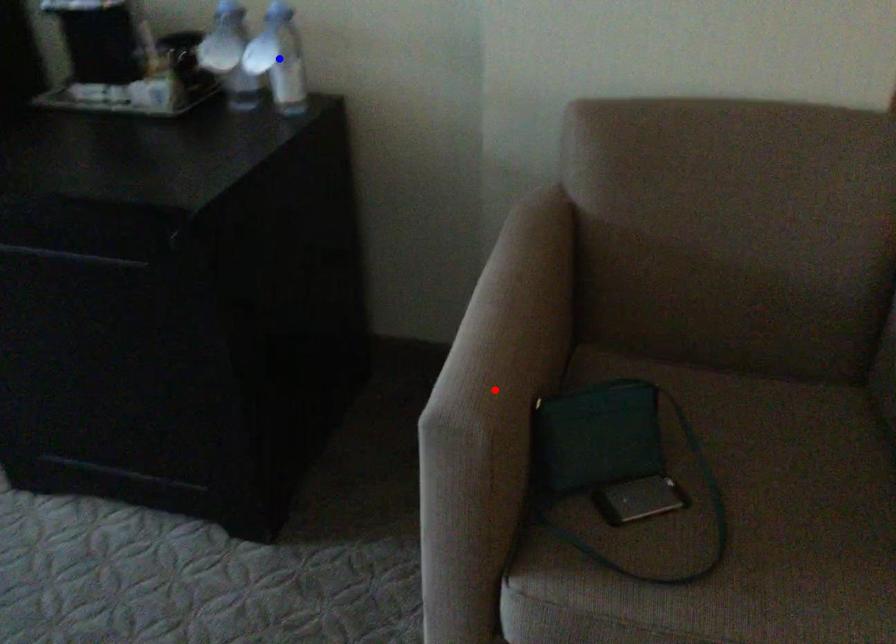
Question: In the image, two points are highlighted. Which point is nearer to the camera? Reply with the corresponding letter.

Choices:
 (A) blue point
 (B) red point

Answer: (B)